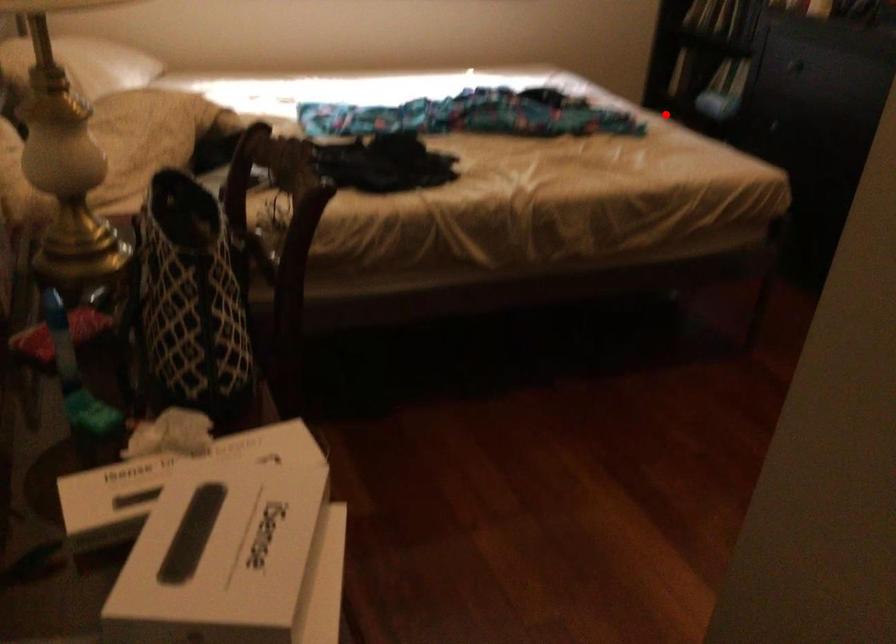
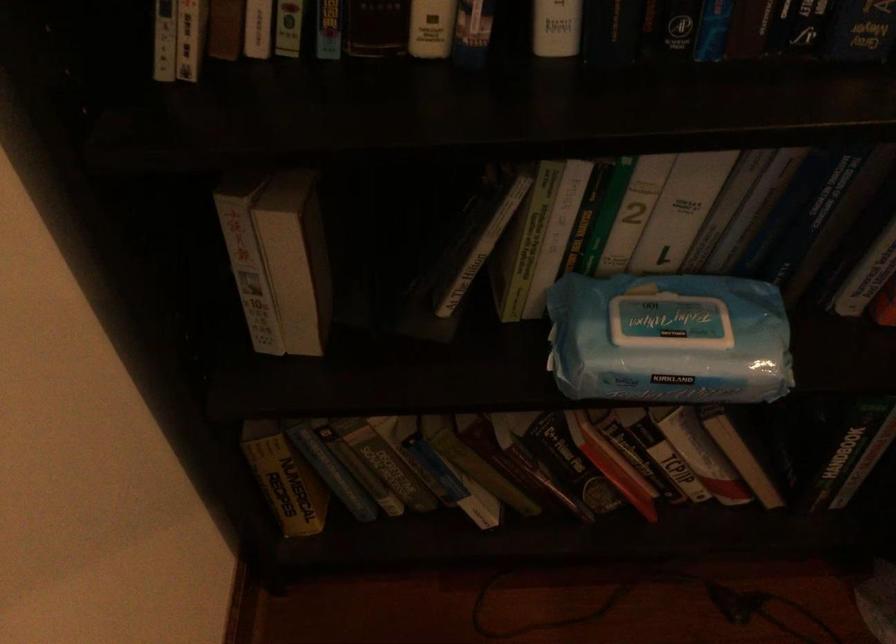
Where in the second image is the point corresponding to the highlighted location from the first image?

(285, 478)